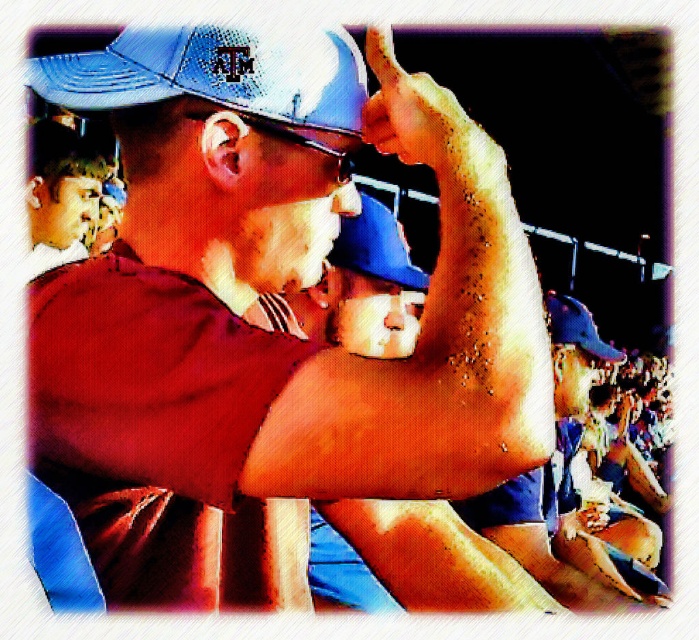
Question: Does matte blue cap at center have a smaller size compared to smooth skin arm at upper center?

Choices:
 (A) yes
 (B) no

Answer: (B)

Question: Which of the following is the farthest from the observer?

Choices:
 (A) smooth skin arm at upper center
 (B) blue textured baseball cap at upper center

Answer: (A)

Question: Which point is farther to the camera?

Choices:
 (A) (43, 260)
 (B) (236, 52)
 (C) (382, 400)

Answer: (A)

Question: Is matte blue cap at center below smooth skin arm at upper center?

Choices:
 (A) no
 (B) yes

Answer: (B)

Question: Is blue textured baseball cap at upper center above smooth skin arm at upper center?

Choices:
 (A) no
 (B) yes

Answer: (A)

Question: Which object is farther from the camera taking this photo?

Choices:
 (A) blue textured baseball cap at upper center
 (B) matte blue cap at center

Answer: (A)